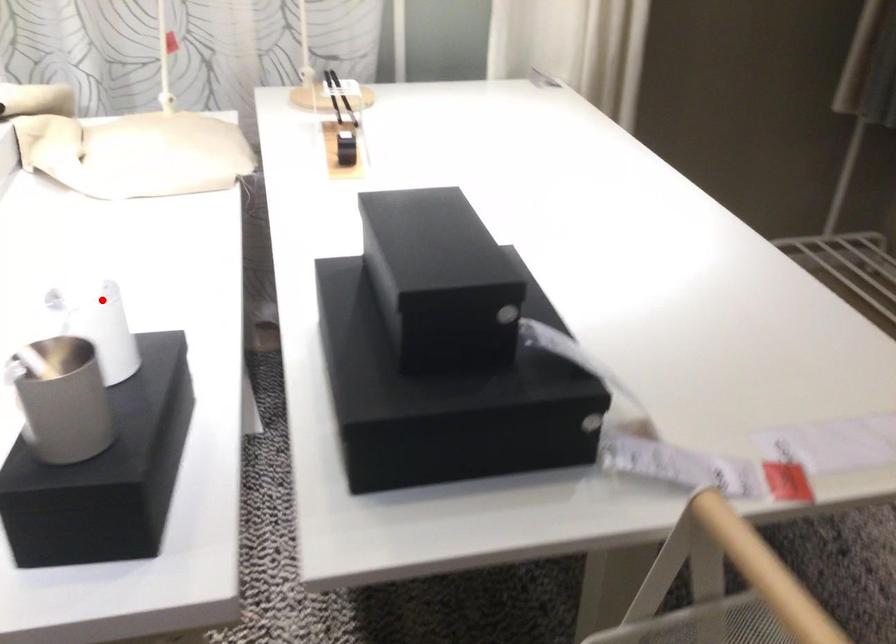
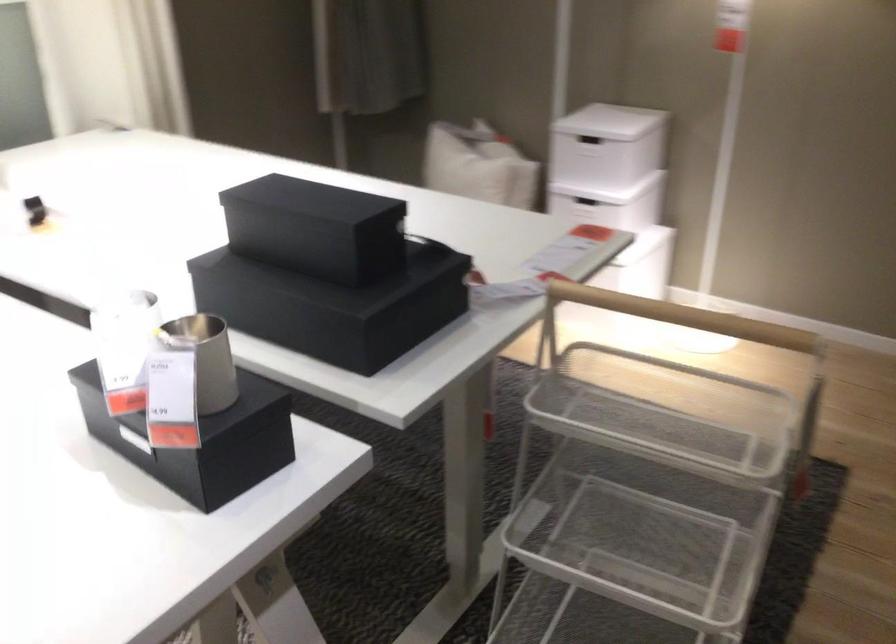
Question: I am providing you with two images of the same scene from different viewpoints. Given a red point in image1, look at the same physical point in image2. Is it:

Choices:
 (A) Closer to the viewpoint
 (B) Farther from the viewpoint

Answer: (B)